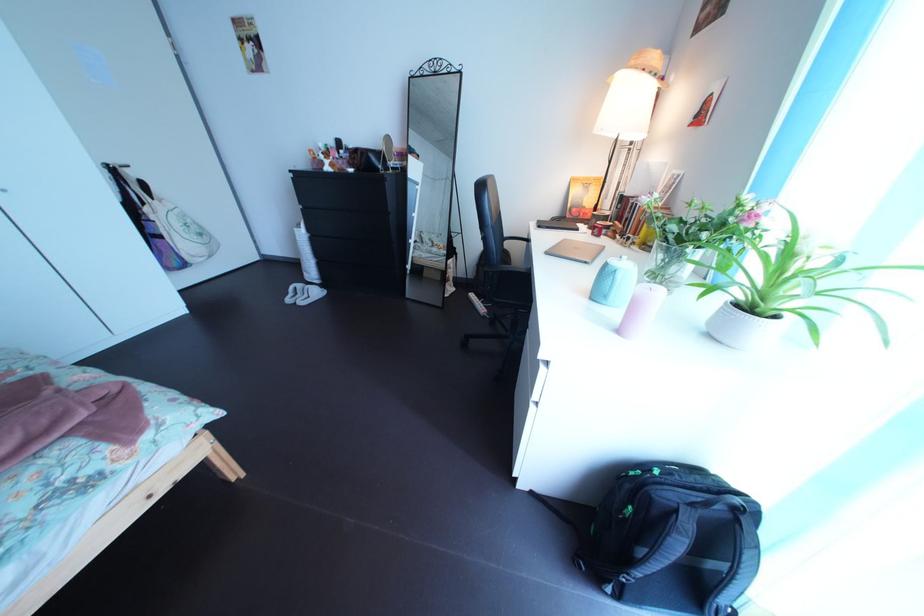
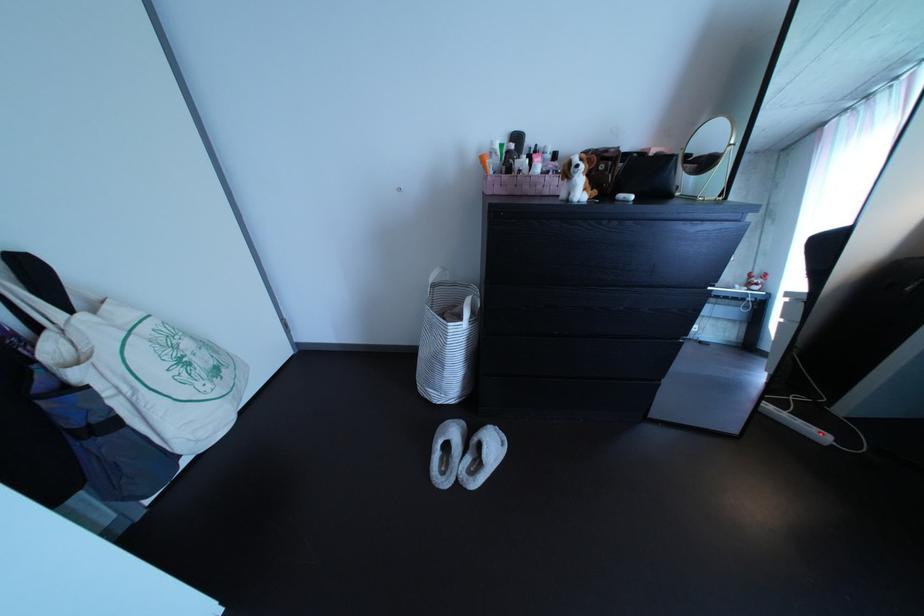
Which direction would the cameraman need to move to produce the second image?

The cameraman moved toward left, forward.